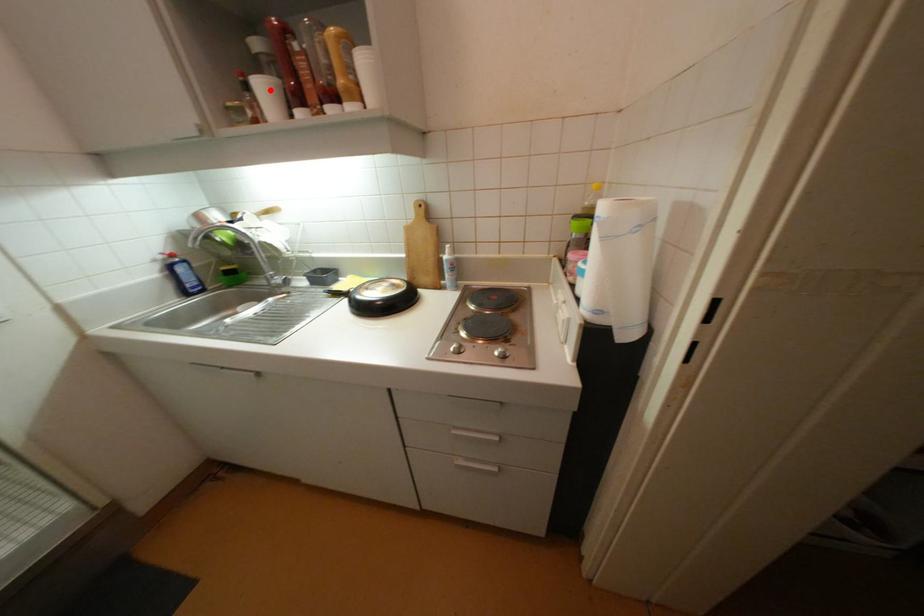
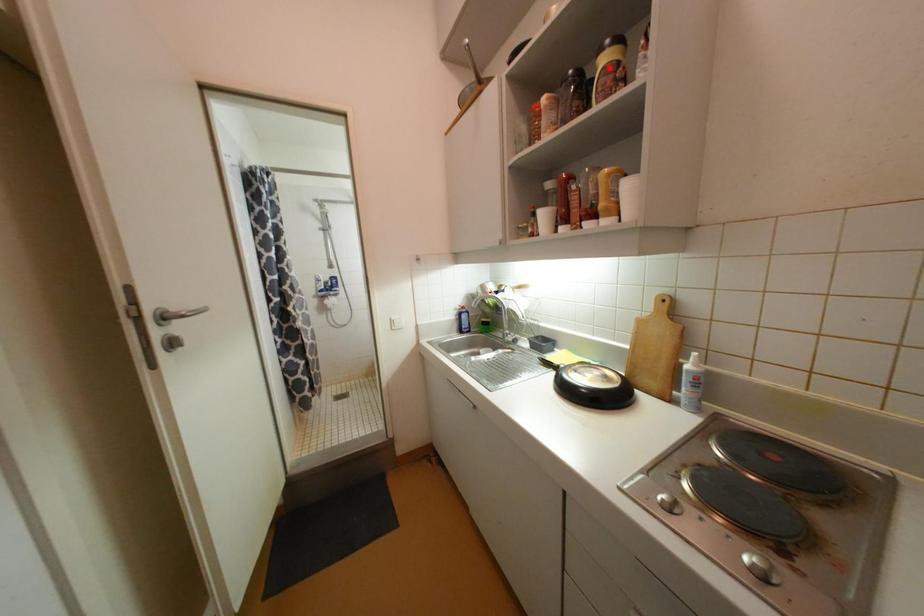
Based on the photo, I am providing you with two images of the same scene from different viewpoints. A red point is marked on the first image and another point is marked on the second image. Are the points marked in image1 and image2 representing the same 3D position?

No